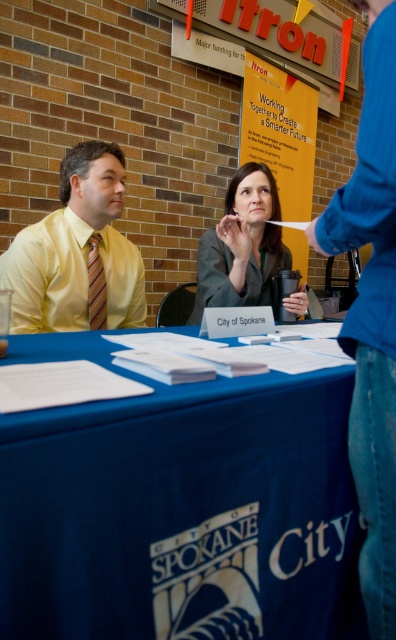
Based on the scene description, which object is smaller in size between the matte gray suit at center and the matte paper poster at upper center?

The matte gray suit at center is smaller in size compared to the matte paper poster at upper center according to the description.

You are attending a job fair and notice two items on the left side of the table. The yellow satin shirt at left and the striped fabric tie at left. Which item is closer to you?

The yellow satin shirt at left is closer to you because it is in front of the striped fabric tie at left.

You are attending the job fair and want to hand your resume to the person in the matte gray suit at center. To do so, you need to walk around the table. Which direction should you approach from to avoid blocking the matte paper poster at upper center behind them?

Since the matte gray suit at center is in front of the matte paper poster at upper center, you should approach from the side opposite to the poster to avoid blocking it. This way, you can reach the person without obstructing the view of the matte paper poster at upper center.